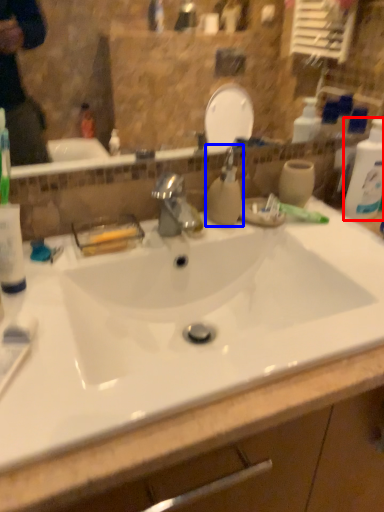
Question: Which point is further to the camera, cleaning product (highlighted by a red box) or soap dispenser (highlighted by a blue box)?

Choices:
 (A) cleaning product
 (B) soap dispenser

Answer: (A)